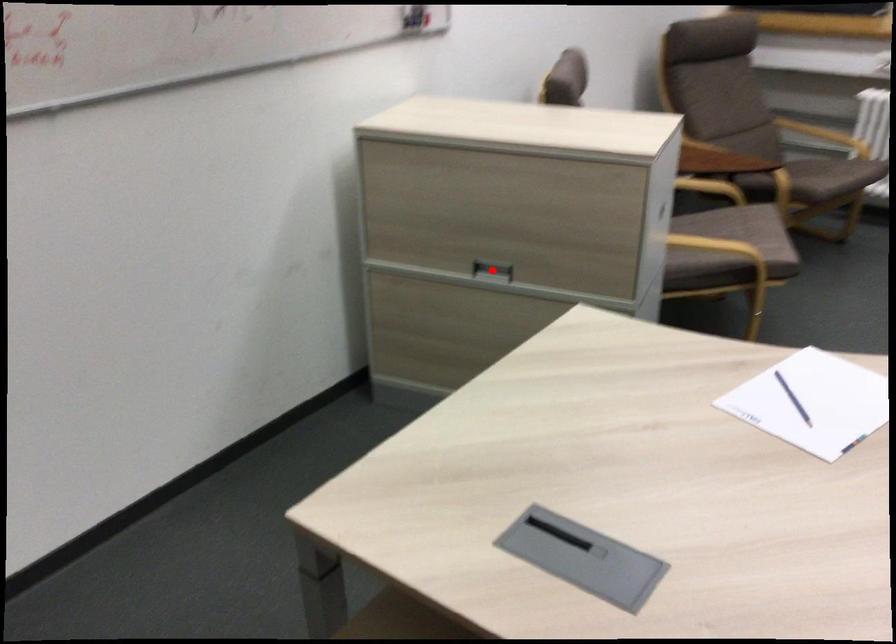
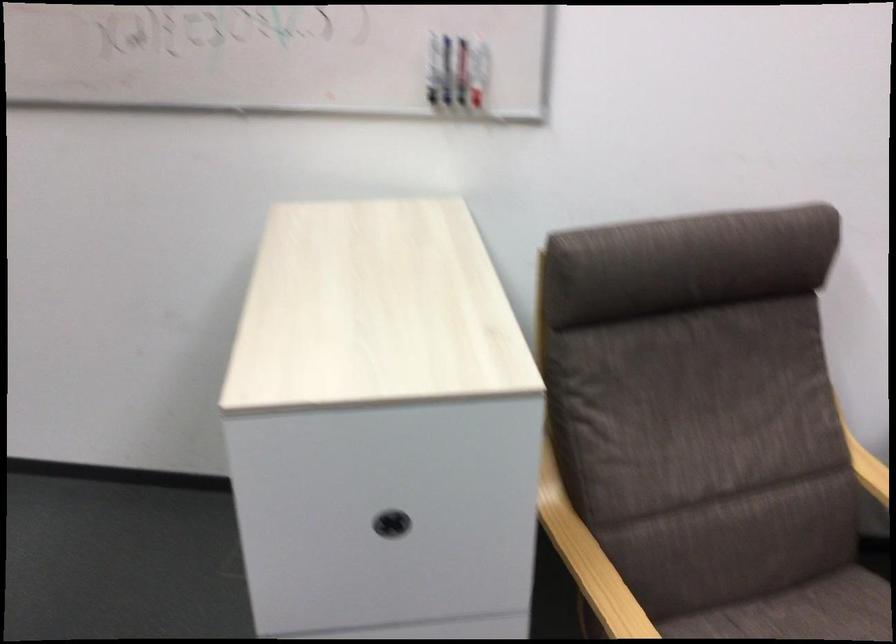
Question: I am providing you with two images of the same scene from different viewpoints. A red point is marked on the first image. Is the red point's position out of view in image 2?

Choices:
 (A) Yes
 (B) No

Answer: (A)